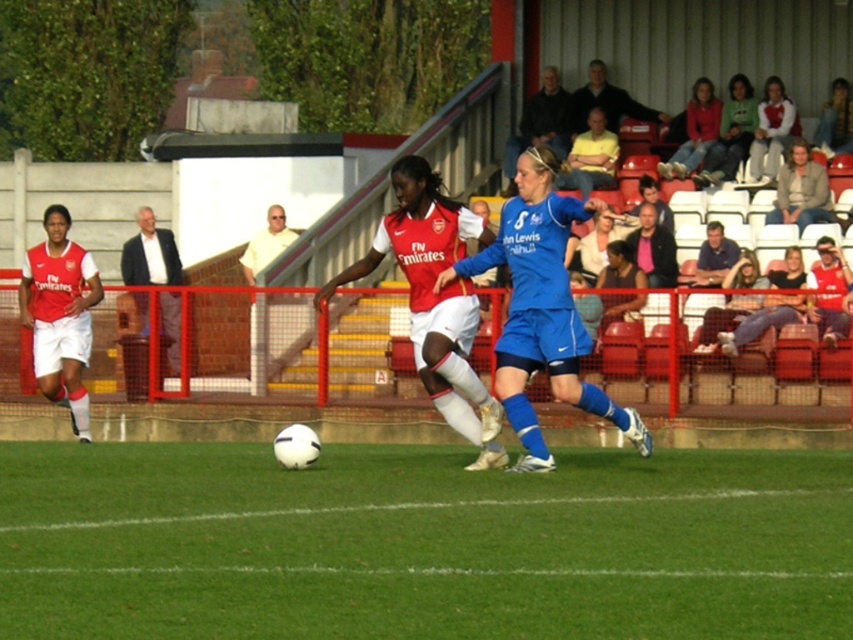
Can you confirm if blue jersey at center is thinner than dark gray jacket at upper center?

Yes, blue jersey at center is thinner than dark gray jacket at upper center.

The width and height of the screenshot is (853, 640). What do you see at coordinates (590, 156) in the screenshot? I see `blue jersey at center` at bounding box center [590, 156].

Image resolution: width=853 pixels, height=640 pixels. I want to click on blue jersey at center, so click(590, 156).

Where is `light brown leather jacket at upper center`? This screenshot has width=853, height=640. light brown leather jacket at upper center is located at coordinates (540, 124).

The height and width of the screenshot is (640, 853). What do you see at coordinates (540, 124) in the screenshot?
I see `light brown leather jacket at upper center` at bounding box center [540, 124].

This screenshot has width=853, height=640. Find the location of `light brown leather jacket at upper center`. light brown leather jacket at upper center is located at coordinates (540, 124).

Can you confirm if white shirt at left is smaller than matte white shirt at center?

No.

The height and width of the screenshot is (640, 853). Describe the element at coordinates (149, 253) in the screenshot. I see `white shirt at left` at that location.

Where is `white shirt at left`? white shirt at left is located at coordinates (149, 253).